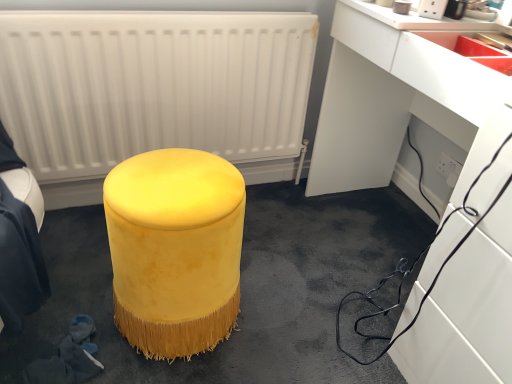
Question: Is velvet yellow ottoman at center shorter than matte red sink at upper right?

Choices:
 (A) yes
 (B) no

Answer: (B)

Question: Does velvet yellow ottoman at center appear on the left side of matte red sink at upper right?

Choices:
 (A) no
 (B) yes

Answer: (B)

Question: From the image's perspective, does velvet yellow ottoman at center appear lower than matte red sink at upper right?

Choices:
 (A) no
 (B) yes

Answer: (B)

Question: Is velvet yellow ottoman at center positioned beyond the bounds of matte red sink at upper right?

Choices:
 (A) yes
 (B) no

Answer: (A)

Question: Is velvet yellow ottoman at center positioned with its back to matte red sink at upper right?

Choices:
 (A) yes
 (B) no

Answer: (B)

Question: Would you say velvet yellow stool at center is to the left or to the right of velvet yellow ottoman at center in the picture?

Choices:
 (A) right
 (B) left

Answer: (A)

Question: From the image's perspective, is velvet yellow stool at center positioned above or below velvet yellow ottoman at center?

Choices:
 (A) below
 (B) above

Answer: (A)

Question: Considering the positions of velvet yellow stool at center and velvet yellow ottoman at center in the image, is velvet yellow stool at center bigger or smaller than velvet yellow ottoman at center?

Choices:
 (A) small
 (B) big

Answer: (B)

Question: In terms of width, does velvet yellow stool at center look wider or thinner when compared to velvet yellow ottoman at center?

Choices:
 (A) thin
 (B) wide

Answer: (B)

Question: Is white matte radiator at upper center in front of or behind white plastic electric outlet at lower right in the image?

Choices:
 (A) front
 (B) behind

Answer: (A)

Question: From the image's perspective, is white matte radiator at upper center positioned above or below white plastic electric outlet at lower right?

Choices:
 (A) above
 (B) below

Answer: (A)

Question: Does point (70, 94) appear closer or farther from the camera than point (443, 172)?

Choices:
 (A) farther
 (B) closer

Answer: (B)

Question: Looking at the image, does white matte radiator at upper center seem bigger or smaller compared to white plastic electric outlet at lower right?

Choices:
 (A) small
 (B) big

Answer: (B)

Question: In terms of width, does matte red sink at upper right look wider or thinner when compared to white plastic electric outlet at lower right?

Choices:
 (A) wide
 (B) thin

Answer: (A)

Question: Considering their positions, is matte red sink at upper right located in front of or behind white plastic electric outlet at lower right?

Choices:
 (A) front
 (B) behind

Answer: (A)